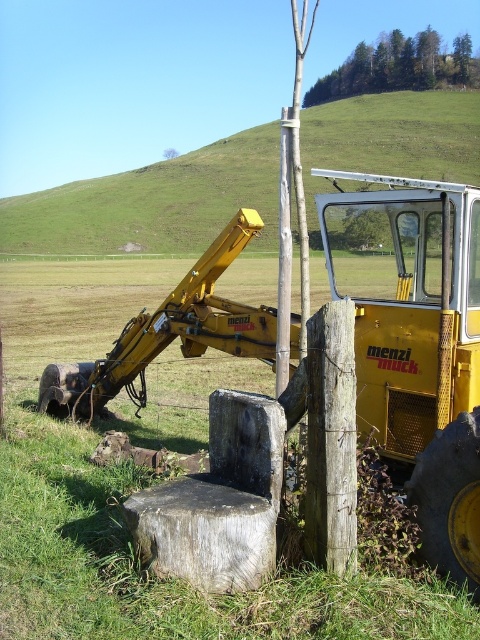
Question: Among these points, which one is nearest to the camera?

Choices:
 (A) (354, 176)
 (B) (451, 84)

Answer: (A)

Question: Is yellow rubber tractor at center wider than green leafy tree at upper center?

Choices:
 (A) yes
 (B) no

Answer: (B)

Question: Which of the following is the closest to the observer?

Choices:
 (A) yellow rubber tractor at center
 (B) green leafy tree at upper center

Answer: (A)

Question: Does yellow rubber tractor at center have a larger size compared to green leafy tree at upper center?

Choices:
 (A) no
 (B) yes

Answer: (A)

Question: Which object appears farthest from the camera in this image?

Choices:
 (A) yellow rubber tractor at center
 (B) green leafy tree at upper center

Answer: (B)

Question: Does yellow rubber tractor at center appear on the right side of green leafy tree at upper center?

Choices:
 (A) no
 (B) yes

Answer: (A)